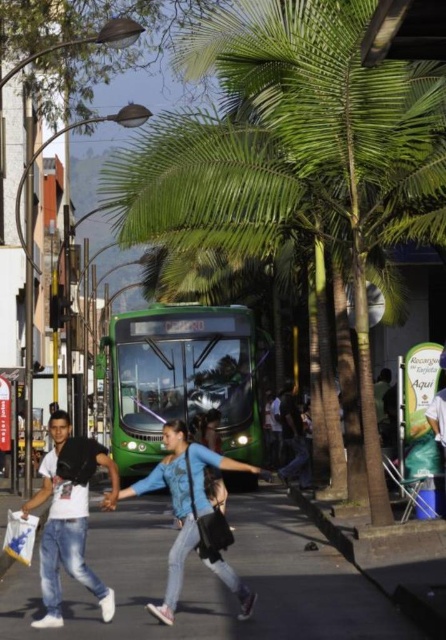
You are standing at the point marked by the coordinates point (396, 128). You want to cross the street to reach the green public bus with

The distance between you and the green public bus with